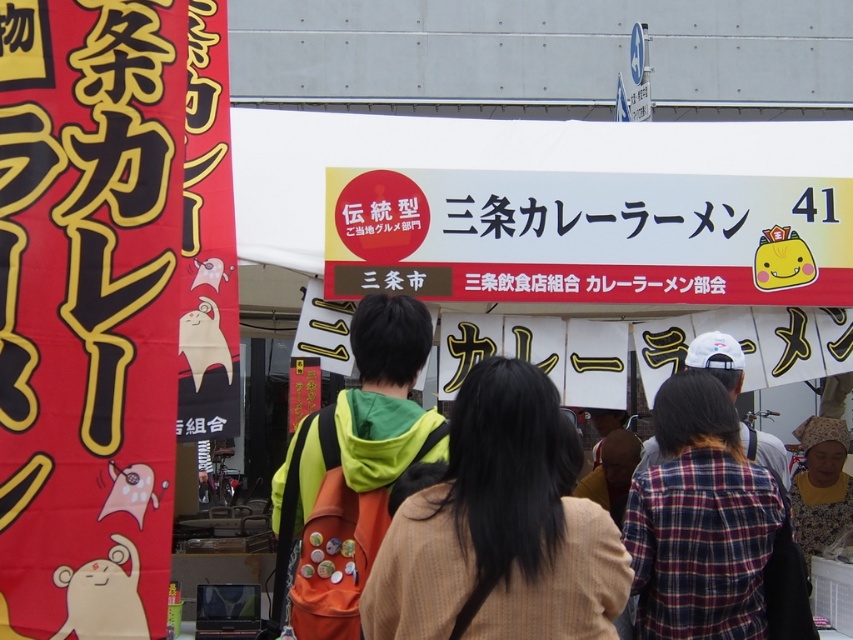
Is white paper sign at center shorter than brown textured coat at center?

Correct, white paper sign at center is not as tall as brown textured coat at center.

Who is lower down, white paper sign at center or brown textured coat at center?

brown textured coat at center is lower down.

Between point (519, 202) and point (437, 540), which one is positioned in front?

Point (437, 540)

This screenshot has height=640, width=853. I want to click on white paper sign at center, so click(x=589, y=236).

Looking at this image, can you confirm if brown textured coat at center is wider than green fabric jacket at center?

Correct, the width of brown textured coat at center exceeds that of green fabric jacket at center.

Which is more to the left, brown textured coat at center or green fabric jacket at center?

green fabric jacket at center

Is point (479, 467) less distant than point (393, 390)?

Yes, point (479, 467) is closer to viewer.

You are a GUI agent. You are given a task and a screenshot of the screen. Output one action in this format:
    pyautogui.click(x=<x>, y=<y>)
    Task: Click on the brown textured coat at center
    
    Given the screenshot: What is the action you would take?
    coord(498,531)

Is point (328, 474) positioned in front of point (718, 564)?

Yes, point (328, 474) is closer to viewer.

Can you confirm if green fabric jacket at center is taller than plaid fabric shirt at center?

Yes.

Where is `green fabric jacket at center`? green fabric jacket at center is located at coordinates (352, 468).

At what (x,y) coordinates should I click in order to perform the action: click on green fabric jacket at center. Please return your answer as a coordinate pair (x, y). This screenshot has height=640, width=853. Looking at the image, I should click on (352, 468).